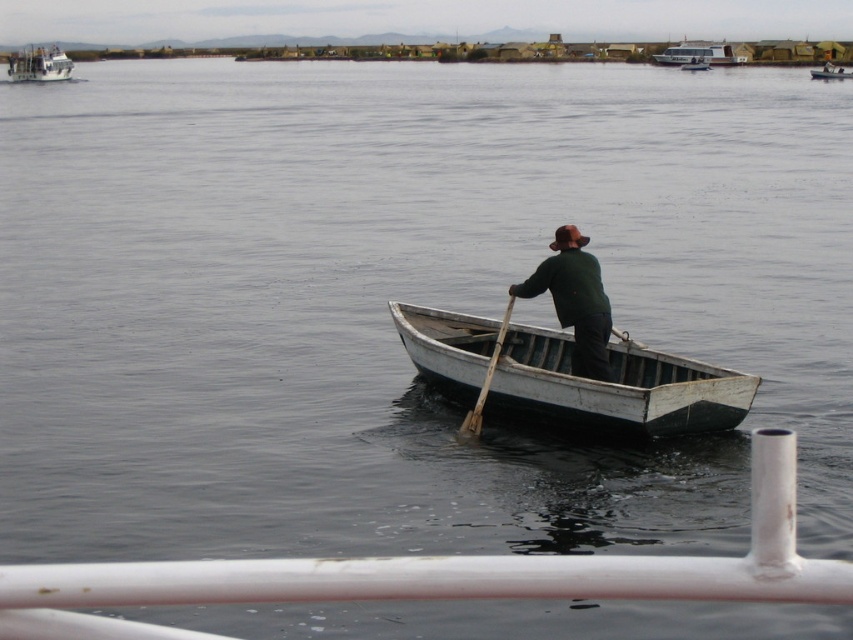
You are standing on the deck of a large ship and see the white wooden canoe at center. If you want to locate it precisely, what are its coordinates?

The white wooden canoe at center is located at coordinates [570,376].

You are a passenger on a boat and want to know which boat is taller between the white wooden boat at upper right and the wooden at center. According to the scene, which one is taller?

The white wooden boat at upper right is taller than the wooden at center.

You are standing on the deck of the larger vessel and see two points in the water. The first point is at coordinates point (415, 305) and the second is at point (22, 60). Which point is closer to you?

Point (415, 305) is closer to the viewer than point (22, 60).